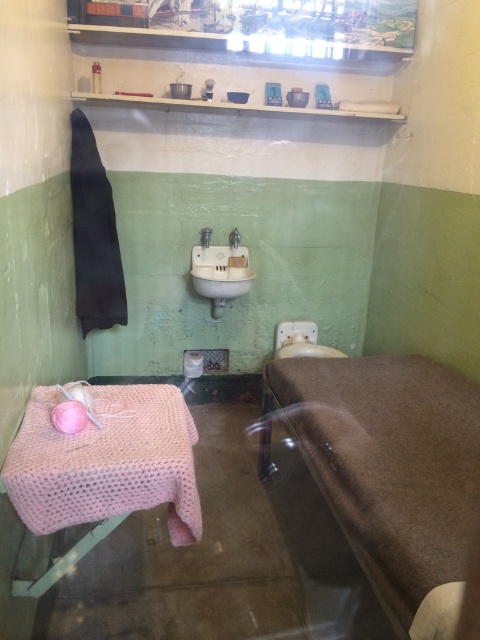
Question: Which of the following is the farthest from the observer?

Choices:
 (A) 165,416
 (B) 298,339
 (C) 203,230

Answer: (B)

Question: Which object is the closest to the white glossy sink at center?

Choices:
 (A) matte white faucet at upper center
 (B) satin silver faucet at center

Answer: (A)

Question: Can you confirm if white glossy sink at center is positioned below white plastic toilet bowl at center?

Choices:
 (A) yes
 (B) no

Answer: (B)

Question: Is white glossy sink at center smaller than white plastic toilet bowl at center?

Choices:
 (A) yes
 (B) no

Answer: (B)

Question: In this image, where is pink knitted tablecloth at lower left located relative to satin silver faucet at center?

Choices:
 (A) below
 (B) above

Answer: (A)

Question: Which of these objects is positioned closest to the satin silver faucet at center?

Choices:
 (A) white plastic toilet bowl at center
 (B) white glossy sink at center
 (C) matte white faucet at upper center
 (D) pink knitted tablecloth at lower left

Answer: (C)